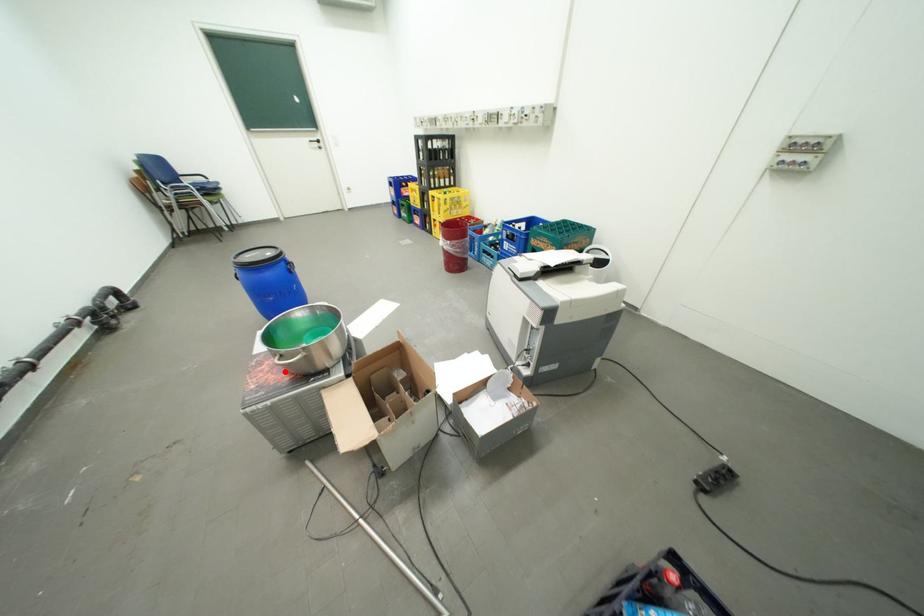
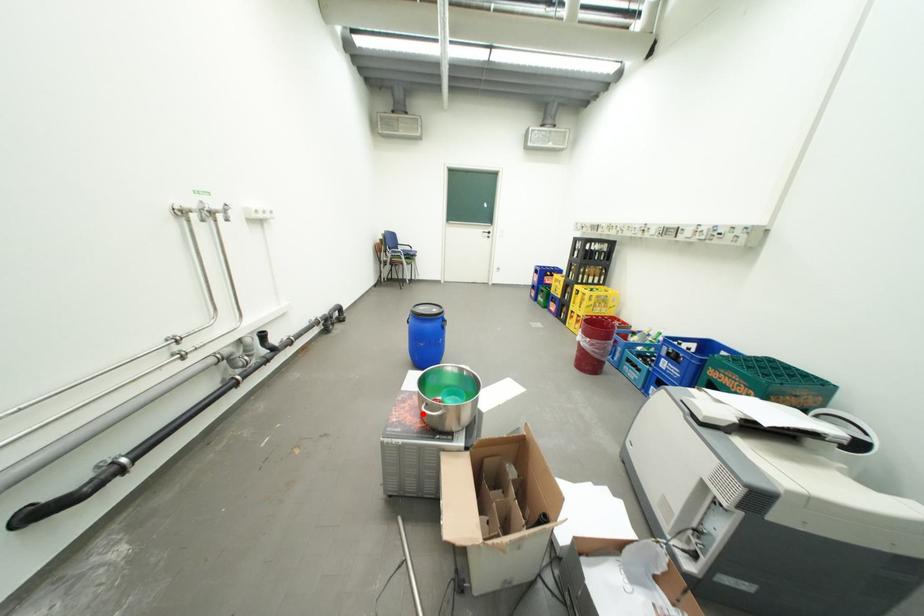
I am providing you with two images of the same scene from different viewpoints. A red point is marked on the first image and another point is marked on the second image. Does the point marked in image1 correspond to the same location as the one in image2?

Yes